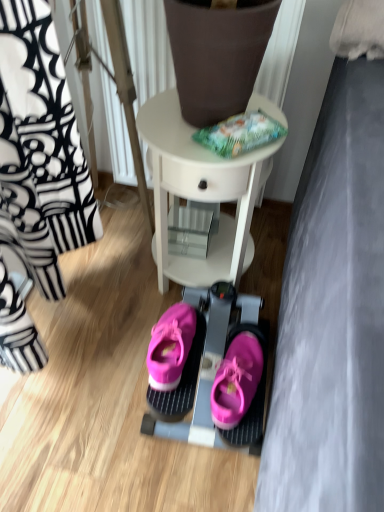
Question: Is pink fabric sneakers at center not near pink suede sneakers at center?

Choices:
 (A) yes
 (B) no

Answer: (B)

Question: From a real-world perspective, is pink fabric sneakers at center physically below pink suede sneakers at center?

Choices:
 (A) yes
 (B) no

Answer: (A)

Question: From the image's perspective, would you say pink fabric sneakers at center is shown under pink suede sneakers at center?

Choices:
 (A) yes
 (B) no

Answer: (A)

Question: Does pink fabric sneakers at center have a lesser height compared to pink suede sneakers at center?

Choices:
 (A) yes
 (B) no

Answer: (B)

Question: From the image's perspective, does pink fabric sneakers at center appear higher than pink suede sneakers at center?

Choices:
 (A) no
 (B) yes

Answer: (A)

Question: Is pink fabric sneakers at center at the left side of pink suede sneakers at center?

Choices:
 (A) yes
 (B) no

Answer: (B)

Question: From the image's perspective, does pink fabric sneakers at center appear lower than white glossy table at center?

Choices:
 (A) no
 (B) yes

Answer: (B)

Question: From a real-world perspective, does pink fabric sneakers at center stand above white glossy table at center?

Choices:
 (A) yes
 (B) no

Answer: (B)

Question: Does pink fabric sneakers at center lie in front of white glossy table at center?

Choices:
 (A) yes
 (B) no

Answer: (B)

Question: Can you confirm if pink fabric sneakers at center is smaller than white glossy table at center?

Choices:
 (A) no
 (B) yes

Answer: (B)

Question: Considering the relative sizes of pink fabric sneakers at center and white glossy table at center in the image provided, is pink fabric sneakers at center bigger than white glossy table at center?

Choices:
 (A) yes
 (B) no

Answer: (B)

Question: From the image's perspective, is pink fabric sneakers at center on top of white glossy table at center?

Choices:
 (A) yes
 (B) no

Answer: (B)

Question: From the image's perspective, would you say pink suede sneakers at center is shown under pink fabric sneakers at center?

Choices:
 (A) yes
 (B) no

Answer: (B)